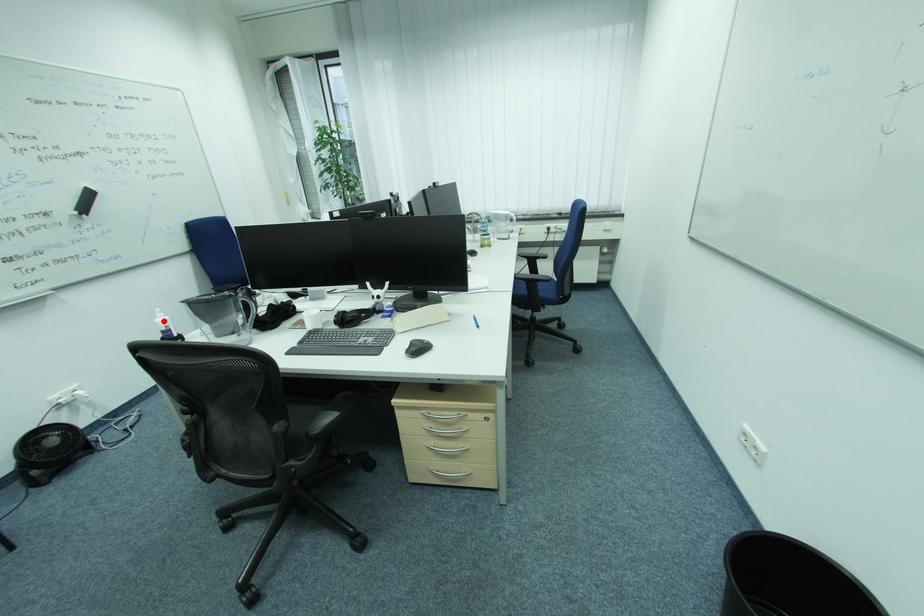
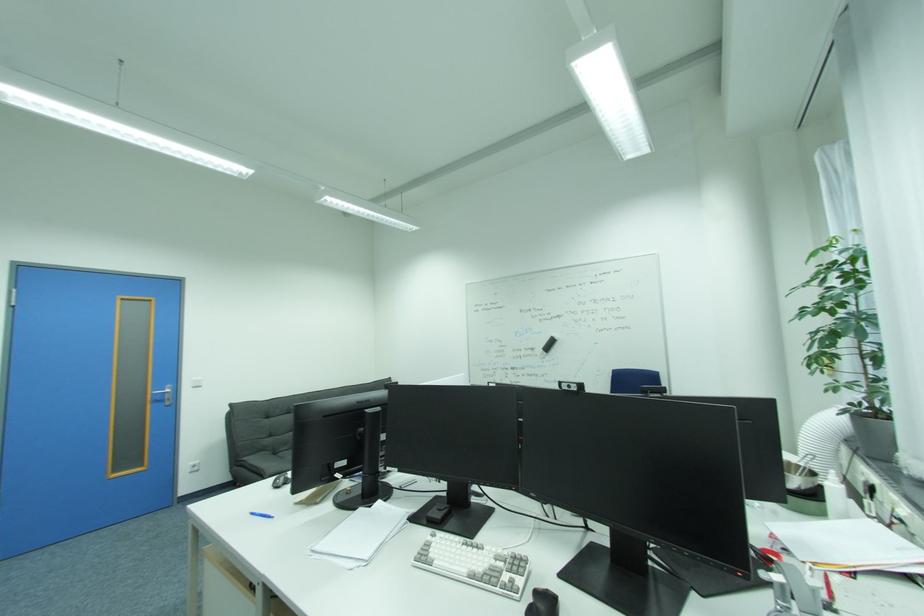
Question: I am providing you with two images of the same scene from different viewpoints. A red point is marked on the first image. At the location where the point appears in image 1, is it still visible in image 2?

Choices:
 (A) Yes
 (B) No

Answer: (B)